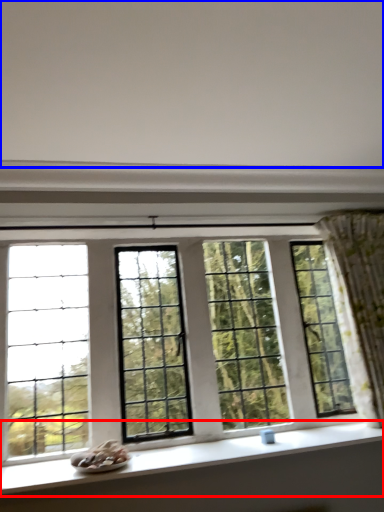
Question: Which of the following is the farthest to the observer, window sill (highlighted by a red box) or backdrop (highlighted by a blue box)?

Choices:
 (A) window sill
 (B) backdrop

Answer: (A)